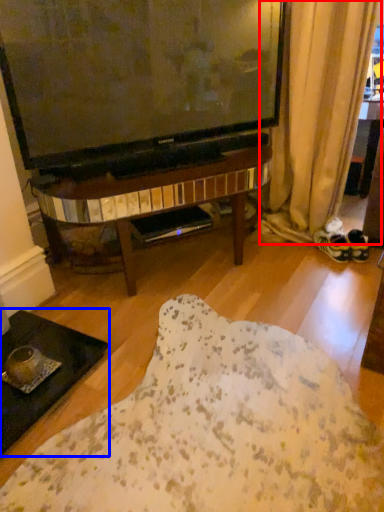
Question: Among these objects, which one is farthest to the camera, curtain (highlighted by a red box) or coffee table (highlighted by a blue box)?

Choices:
 (A) curtain
 (B) coffee table

Answer: (A)